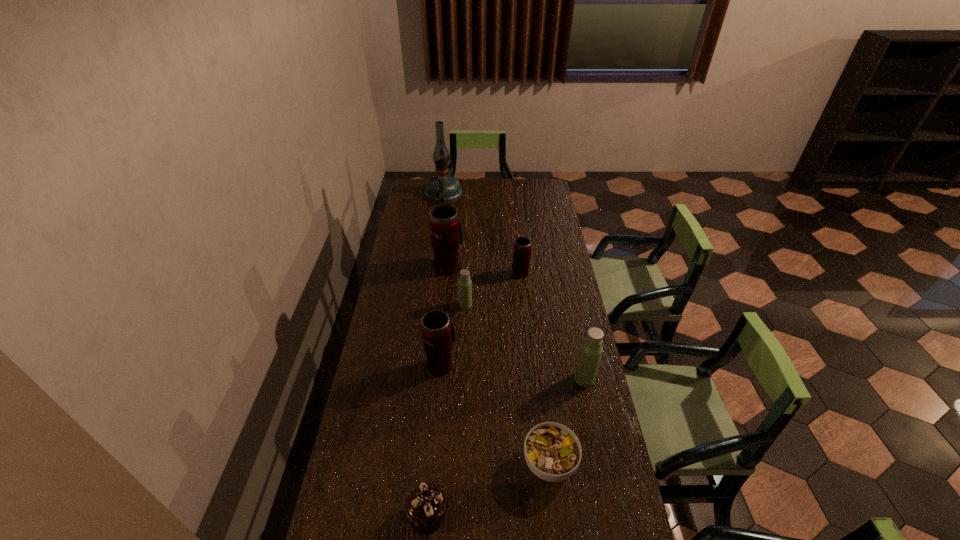
Find the location of `soup bowl present at the right edge`. soup bowl present at the right edge is located at coordinates (552, 451).

Image resolution: width=960 pixels, height=540 pixels. I want to click on object that is at the far left corner, so click(x=442, y=188).

In the image, there is a desktop. Identify the location of vacant space at the right edge. This screenshot has width=960, height=540. (553, 214).

Find the location of `vacant area at the far right corner`. vacant area at the far right corner is located at coordinates (534, 181).

Find the location of a particular element. This screenshot has width=960, height=540. free space between the fourth farthest object and the second nearest object is located at coordinates (508, 384).

Locate an element on the screen. unoccupied position between the farther light thermos bottle and the seventh tallest object is located at coordinates (446, 410).

Find the location of `vacant area that lies between the tallest object and the rightmost thermos bottle`. vacant area that lies between the tallest object and the rightmost thermos bottle is located at coordinates (514, 286).

Find the location of a particular element. The width and height of the screenshot is (960, 540). vacant area that lies between the rightmost thermos bottle and the farthest object is located at coordinates (514, 286).

The width and height of the screenshot is (960, 540). Identify the location of unoccupied position between the bigger light thermos bottle and the soup bowl. (567, 421).

Locate an element on the screen. This screenshot has width=960, height=540. free space between the soup bowl and the second thermos bottle from right to left is located at coordinates (535, 369).